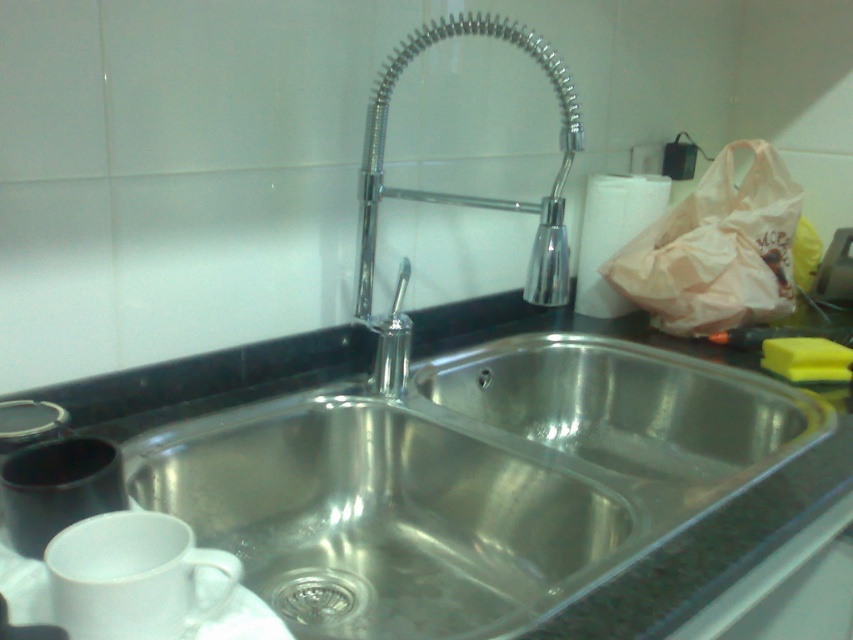
Who is lower down, stainless steel sink at center or chrome/metallic faucet at center?

stainless steel sink at center is lower down.

Is stainless steel sink at center closer to the viewer compared to chrome/metallic faucet at center?

That is True.

The image size is (853, 640). What do you see at coordinates (706, 548) in the screenshot?
I see `stainless steel sink at center` at bounding box center [706, 548].

You are a GUI agent. You are given a task and a screenshot of the screen. Output one action in this format:
    pyautogui.click(x=<x>, y=<y>)
    Task: Click on the stainless steel sink at center
    This screenshot has height=640, width=853.
    Given the screenshot: What is the action you would take?
    706,548

Can you confirm if chrome/metallic faucet at center is bigger than brushed metal drain at center?

Yes.

What do you see at coordinates (459, 195) in the screenshot? I see `chrome/metallic faucet at center` at bounding box center [459, 195].

At what (x,y) coordinates should I click in order to perform the action: click on chrome/metallic faucet at center. Please return your answer as a coordinate pair (x, y). The width and height of the screenshot is (853, 640). Looking at the image, I should click on (459, 195).

Can you confirm if stainless steel sink at center is positioned to the left of brushed metal drain at center?

In fact, stainless steel sink at center is to the right of brushed metal drain at center.

Which is behind, point (596, 602) or point (294, 586)?

The point (294, 586) is behind.

Locate an element on the screen. The width and height of the screenshot is (853, 640). stainless steel sink at center is located at coordinates (706, 548).